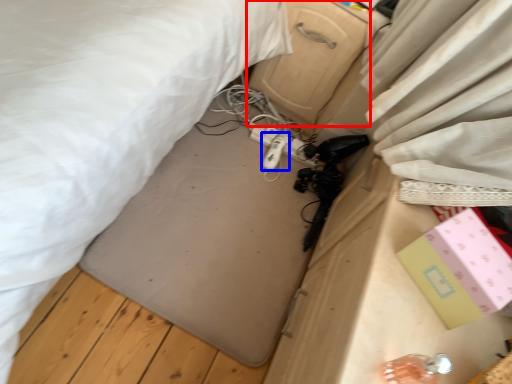
Question: Which object appears farthest to the camera in this image, drawer (highlighted by a red box) or equipment (highlighted by a blue box)?

Choices:
 (A) drawer
 (B) equipment

Answer: (B)